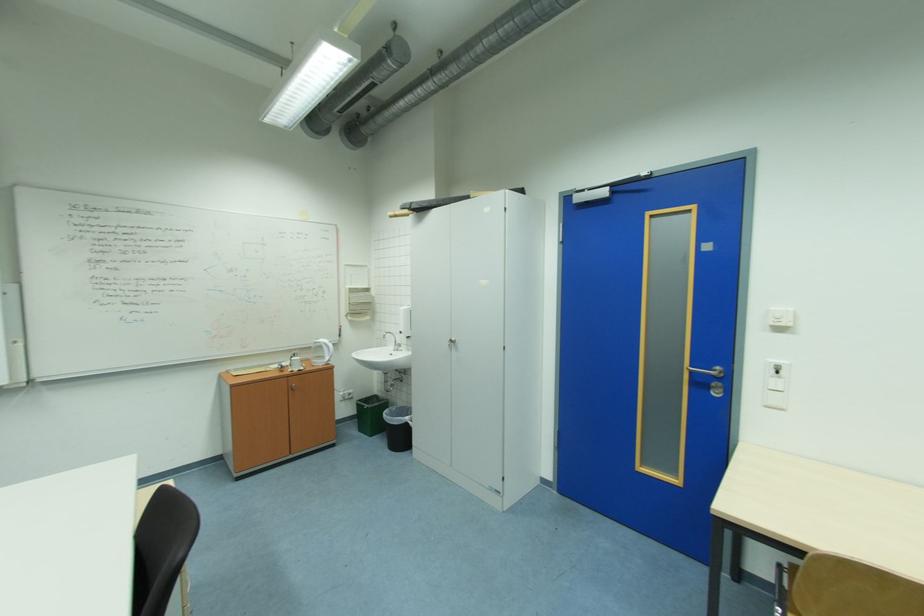
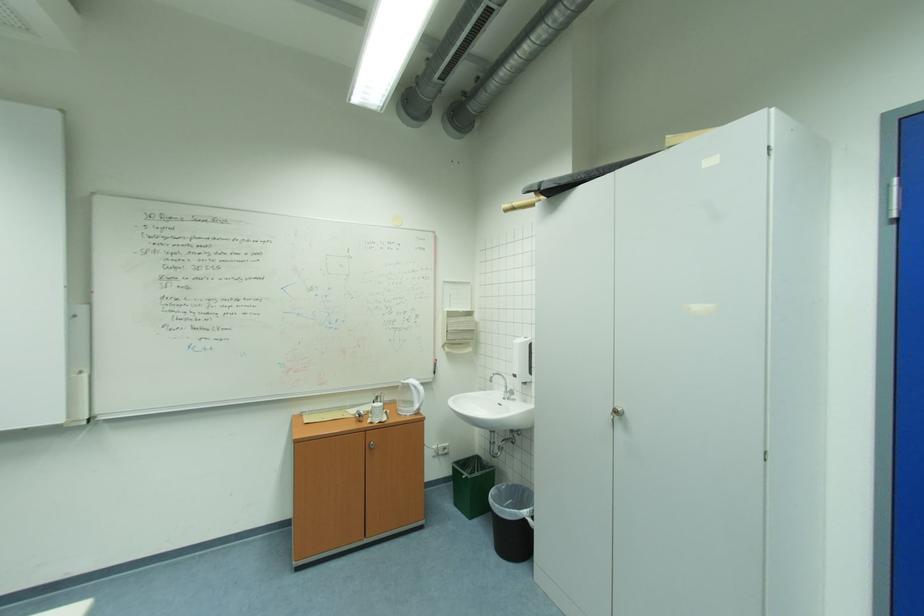
In the second image, find the point that corresponds to (369,431) in the first image.

(464, 505)